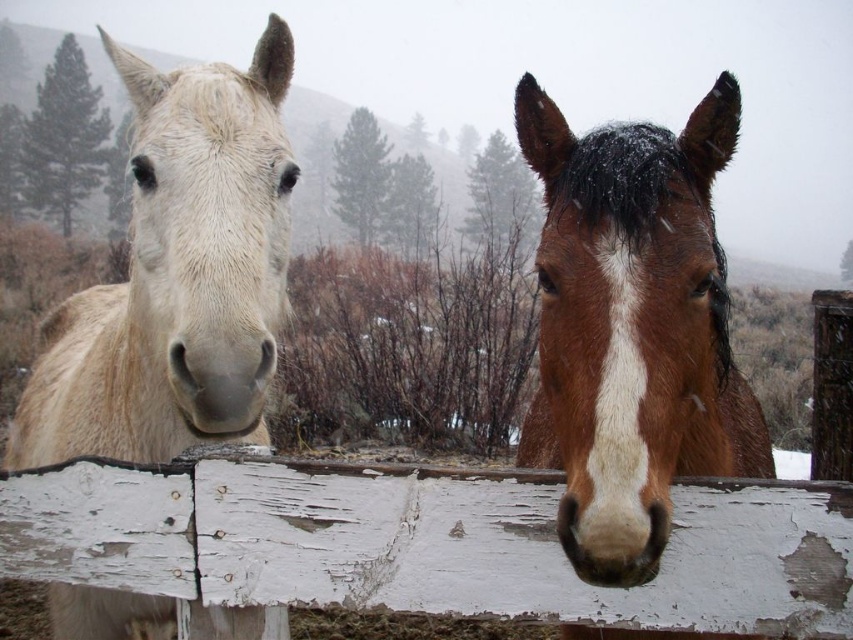
You are a painter standing in front of the wooden fence between the two horses. You want to paint the white peeling wood at center and the light beige fur at left. Which object is narrower?

The white peeling wood at center has a lesser width compared to light beige fur at left, so the white peeling wood at center is narrower.

You are standing in the snowy field looking at the two horses near the fence. There are two points marked in the image. The first point is at coordinate point(657, 166) and the second point is at coordinate point(235, 72). If you want to walk from the first point to the second point, which direction should you move relative to the second point?

To move from point(657, 166) to point(235, 72), you should move towards the direction that is behind the second point since point(657, 166) is in front of point(235, 72).

You are standing in a snowy field looking at two horses near a wooden fence. There is a specific point at coordinates point (163, 536) that is 1.09 meters away from you. If you want to reach that point without moving your feet, which direction should you look?

You should look towards the point (163, 536), which is 1.09 meters away from you, so you need to adjust your gaze in that direction without moving your feet.